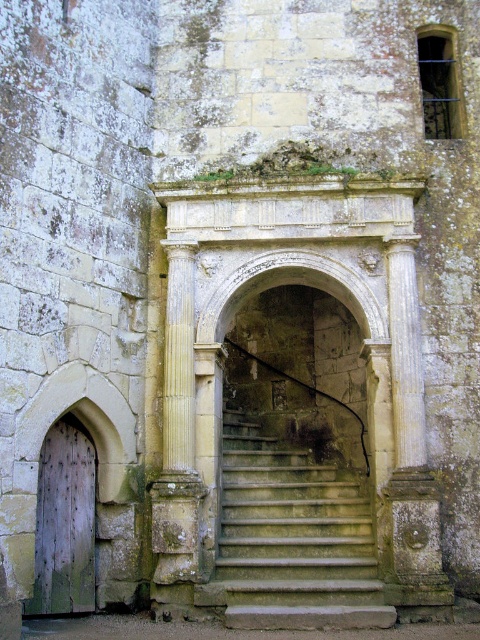
Question: Which point appears closest to the camera in this image?

Choices:
 (A) (367, 612)
 (B) (188, 301)

Answer: (A)

Question: Which object is closer to the camera taking this photo?

Choices:
 (A) stone steps at center
 (B) weathered wood door at lower left
 (C) yellow stone column at center

Answer: (A)

Question: Considering the relative positions of yellow stone column at center and weathered wood door at lower left in the image provided, where is yellow stone column at center located with respect to weathered wood door at lower left?

Choices:
 (A) left
 (B) right

Answer: (B)

Question: Observing the image, what is the correct spatial positioning of stone steps at center in reference to weathered wood door at lower left?

Choices:
 (A) right
 (B) left

Answer: (A)

Question: Based on their relative distances, which object is farther from the weathered wood door at lower left?

Choices:
 (A) yellow stone column at center
 (B) stone steps at center

Answer: (B)

Question: Can you confirm if yellow stone column at center is positioned below weathered wood door at lower left?

Choices:
 (A) yes
 (B) no

Answer: (B)